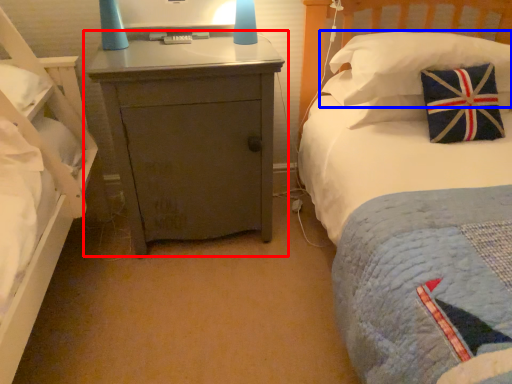
Question: Which object is closer to the camera taking this photo, nightstand (highlighted by a red box) or pillow (highlighted by a blue box)?

Choices:
 (A) nightstand
 (B) pillow

Answer: (A)